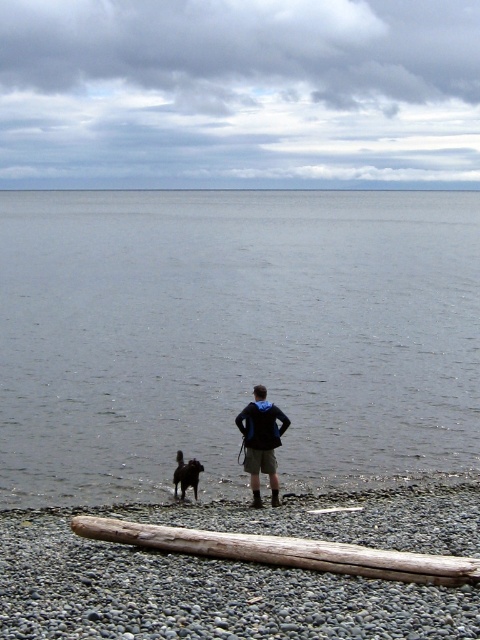
Question: Based on their relative distances, which object is farther from the driftwood log at lower center?

Choices:
 (A) smooth pebbles at lower center
 (B) black matte jacket at center
 (C) smooth gray water at lower center
 (D) shiny black fur at lower left

Answer: (C)

Question: Is the position of smooth pebbles at lower center less distant than that of driftwood log at lower center?

Choices:
 (A) no
 (B) yes

Answer: (A)

Question: Which point is closer to the camera taking this photo?

Choices:
 (A) (50, 547)
 (B) (372, 572)

Answer: (B)

Question: Which object is closer to the camera taking this photo?

Choices:
 (A) shiny black fur at lower left
 (B) smooth gray water at lower center
 (C) smooth pebbles at lower center
 (D) driftwood log at lower center

Answer: (D)

Question: Considering the relative positions of smooth pebbles at lower center and driftwood log at lower center in the image provided, where is smooth pebbles at lower center located with respect to driftwood log at lower center?

Choices:
 (A) above
 (B) below

Answer: (B)

Question: Can you confirm if smooth pebbles at lower center is positioned above shiny black fur at lower left?

Choices:
 (A) yes
 (B) no

Answer: (B)